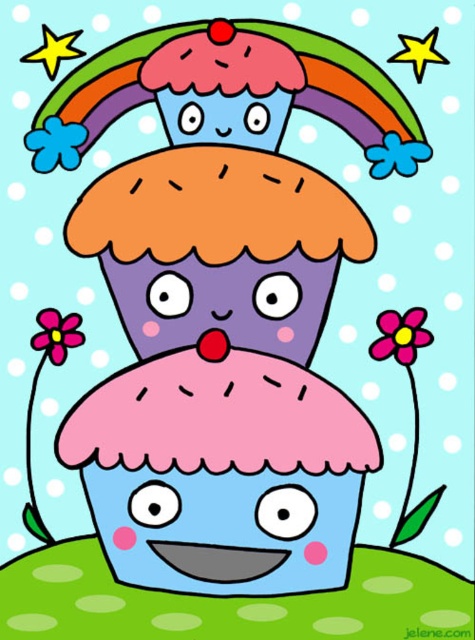
Question: Which object is closer to the camera taking this photo?

Choices:
 (A) pink matte flower at lower left
 (B) pink fabric flower at upper right
 (C) purple matte cupcake face at center

Answer: (B)

Question: Which point is closer to the camera?

Choices:
 (A) (50, 131)
 (B) (209, 330)
 (C) (38, 333)
 (D) (252, 474)

Answer: (D)

Question: Does purple matte cupcake face at center have a lesser width compared to pink matte flower at lower left?

Choices:
 (A) no
 (B) yes

Answer: (A)

Question: Is matte blue cupcake at center in front of blue matte flower at upper left?

Choices:
 (A) no
 (B) yes

Answer: (B)

Question: Which point is farther from the camera taking this photo?

Choices:
 (A) (275, 278)
 (B) (69, 156)

Answer: (B)

Question: Does matte blue cupcake at center appear over purple matte cupcake face at center?

Choices:
 (A) no
 (B) yes

Answer: (A)